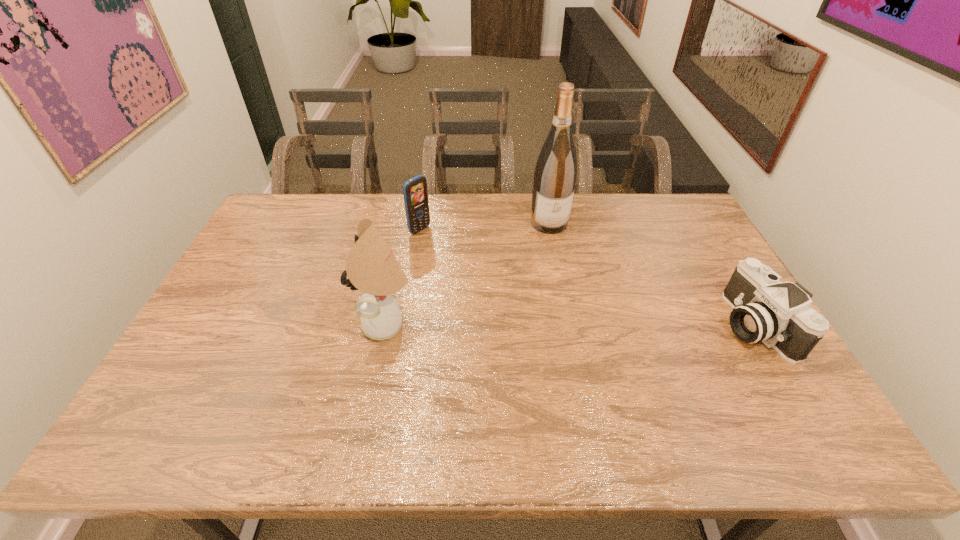
Where is `the second tallest object`? the second tallest object is located at coordinates (371, 267).

The image size is (960, 540). I want to click on the shortest object, so click(779, 314).

This screenshot has height=540, width=960. I want to click on the rightmost object, so click(779, 314).

I want to click on the second shortest object, so click(x=415, y=193).

At what (x,y) coordinates should I click in order to perform the action: click on the second object from right to left. Please return your answer as a coordinate pair (x, y). Looking at the image, I should click on (555, 175).

Image resolution: width=960 pixels, height=540 pixels. Identify the location of the tallest object. click(x=555, y=175).

This screenshot has width=960, height=540. I want to click on vacant space located at the front face of the doll, so click(x=344, y=325).

The width and height of the screenshot is (960, 540). I want to click on vacant space located 0.050m at the front face of the doll, so coord(344,325).

Find the location of a particular element. The width and height of the screenshot is (960, 540). vacant space located 0.080m at the front face of the doll is located at coordinates (332, 325).

Where is `vacant space positioned 0.400m on the back of the camera`? vacant space positioned 0.400m on the back of the camera is located at coordinates (687, 214).